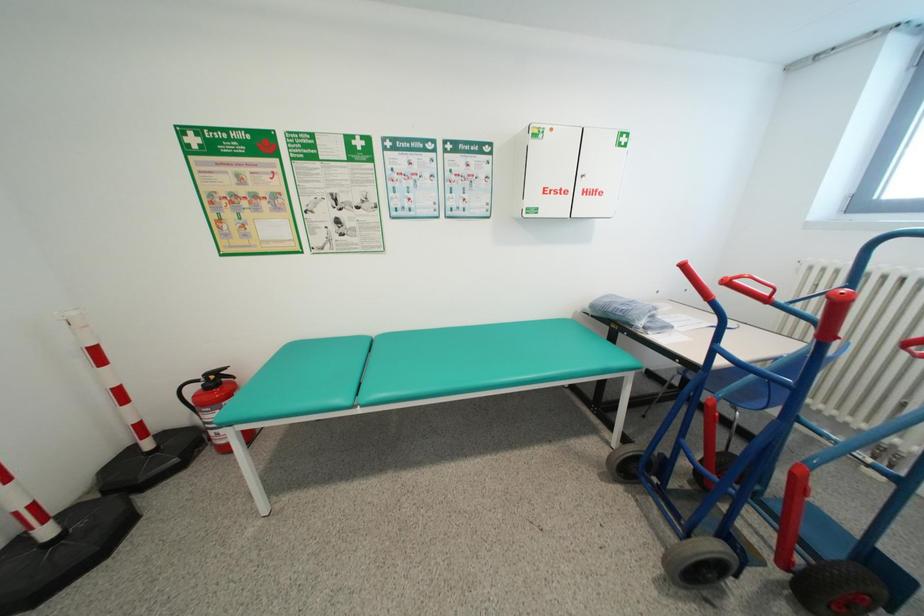
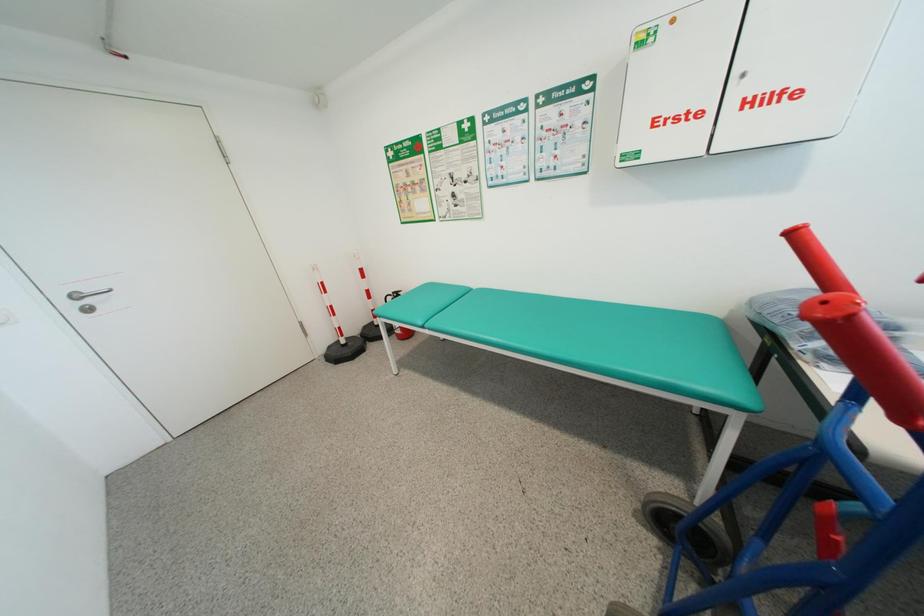
Question: The images are taken continuously from a first-person perspective. In which direction is your viewpoint rotating?

Choices:
 (A) Left
 (B) Right
 (C) Up
 (D) Down

Answer: (A)